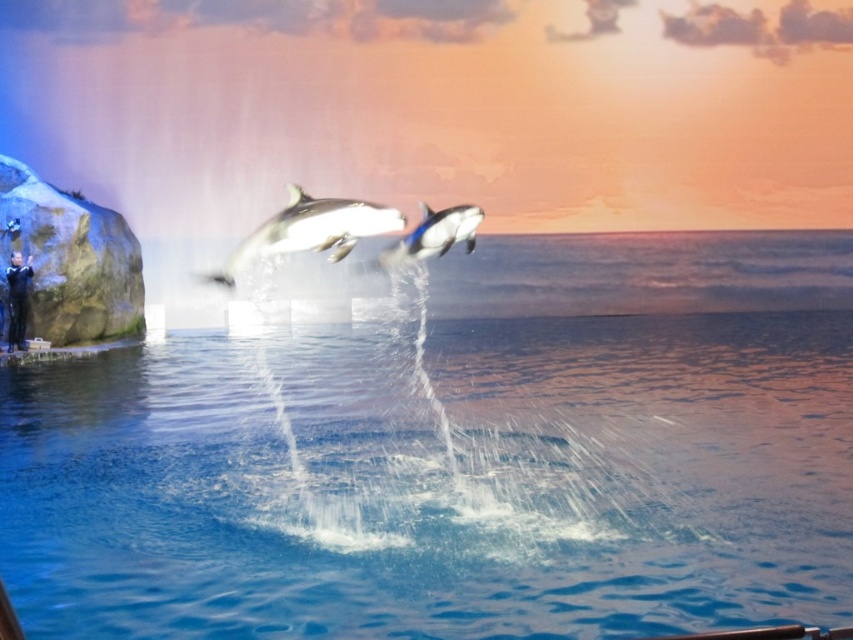
Does black smooth dolphin at center come in front of black and white dolphin at center?

Yes, it is in front of black and white dolphin at center.

Is black smooth dolphin at center thinner than black and white dolphin at center?

Incorrect, black smooth dolphin at center's width is not less than black and white dolphin at center's.

Is point (329, 232) in front of point (474, 211)?

Yes, point (329, 232) is in front of point (474, 211).

This screenshot has width=853, height=640. Identify the location of black smooth dolphin at center. (309, 230).

Does point (380, 577) come closer to viewer compared to point (457, 212)?

Yes.

Is clear blue water at center wider than black and white dolphin at center?

Correct, the width of clear blue water at center exceeds that of black and white dolphin at center.

In order to click on clear blue water at center in this screenshot , I will do `click(456, 454)`.

Who is more forward, (268,234) or (9,333)?

Point (268,234) is more forward.

Which is behind, point (393, 225) or point (16, 269)?

Point (16, 269)

Is point (364, 205) closer to viewer compared to point (9, 296)?

Yes.

Where is `black smooth dolphin at center`? black smooth dolphin at center is located at coordinates (309, 230).